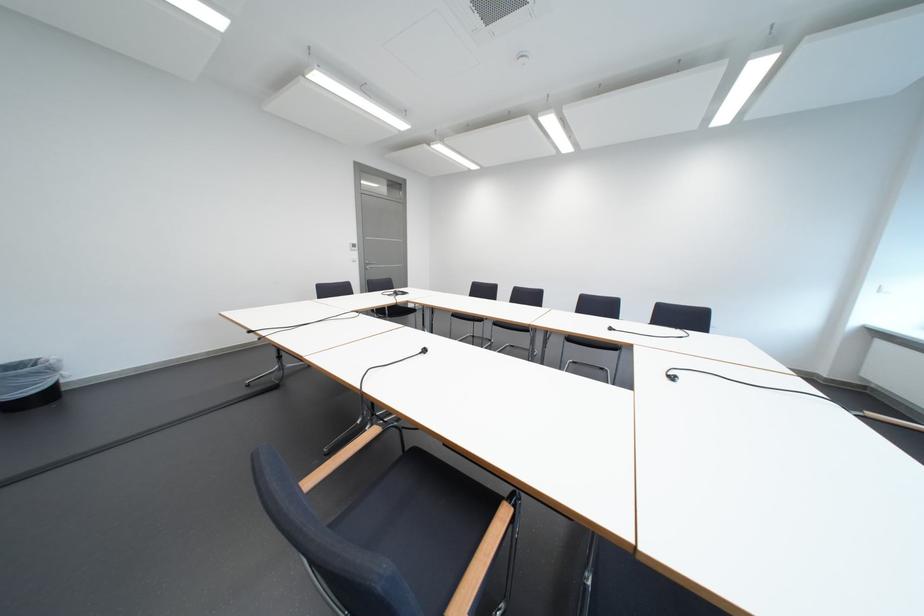
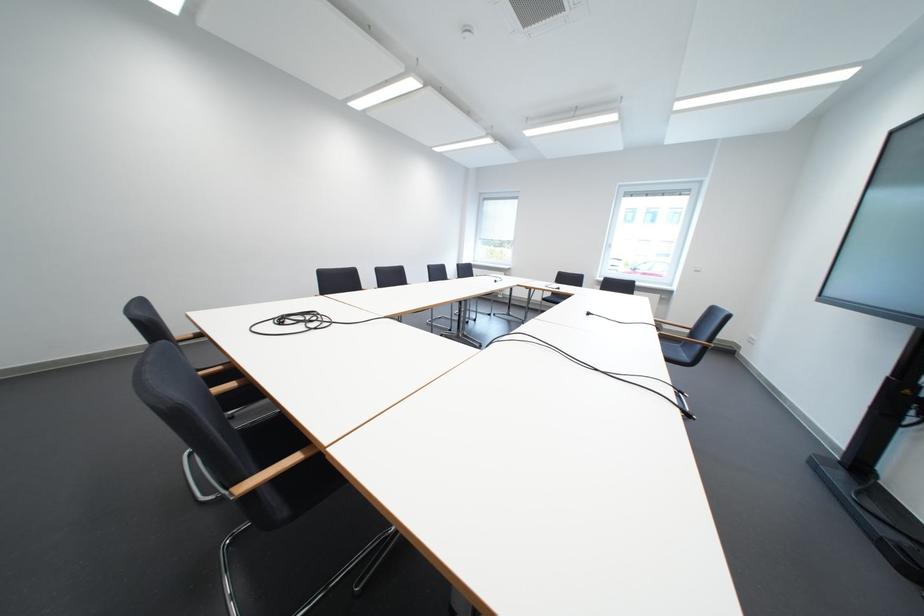
Locate, in the second image, the point that corresponds to [436,353] in the first image.

(601, 315)